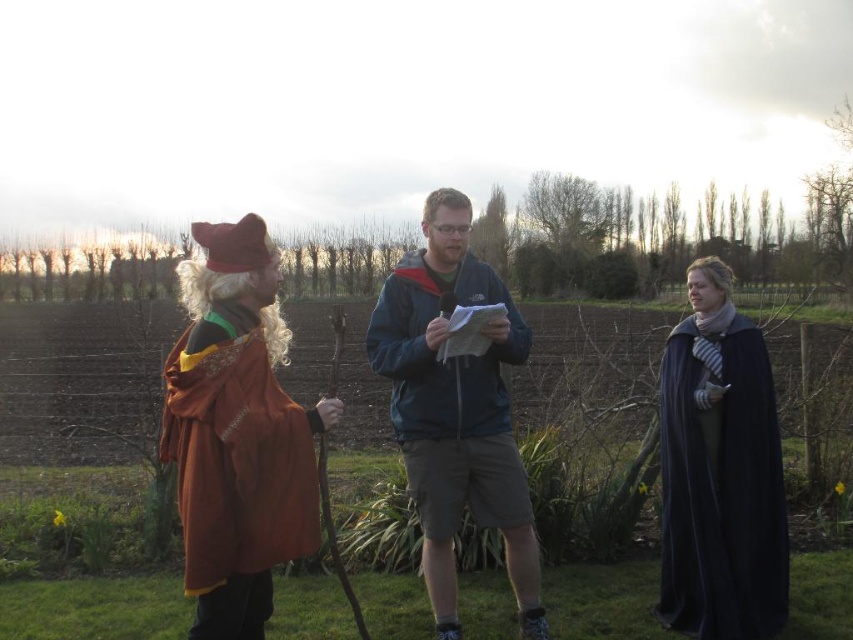
Question: Which object appears farthest from the camera in this image?

Choices:
 (A) velvet orange cloak at left
 (B) dark blue jacket at center
 (C) dark blue velvet cape at right

Answer: (C)

Question: Is dark blue jacket at center above dark blue velvet cape at right?

Choices:
 (A) no
 (B) yes

Answer: (B)

Question: Can you confirm if dark blue jacket at center is positioned below dark blue velvet cape at right?

Choices:
 (A) yes
 (B) no

Answer: (B)

Question: Among these points, which one is nearest to the camera?

Choices:
 (A) (450, 256)
 (B) (740, 320)
 (C) (236, 573)

Answer: (C)

Question: From the image, what is the correct spatial relationship of velvet orange cloak at left in relation to dark blue velvet cape at right?

Choices:
 (A) left
 (B) right

Answer: (A)

Question: Which point is closer to the camera taking this photo?

Choices:
 (A) (215, 241)
 (B) (422, 278)

Answer: (A)